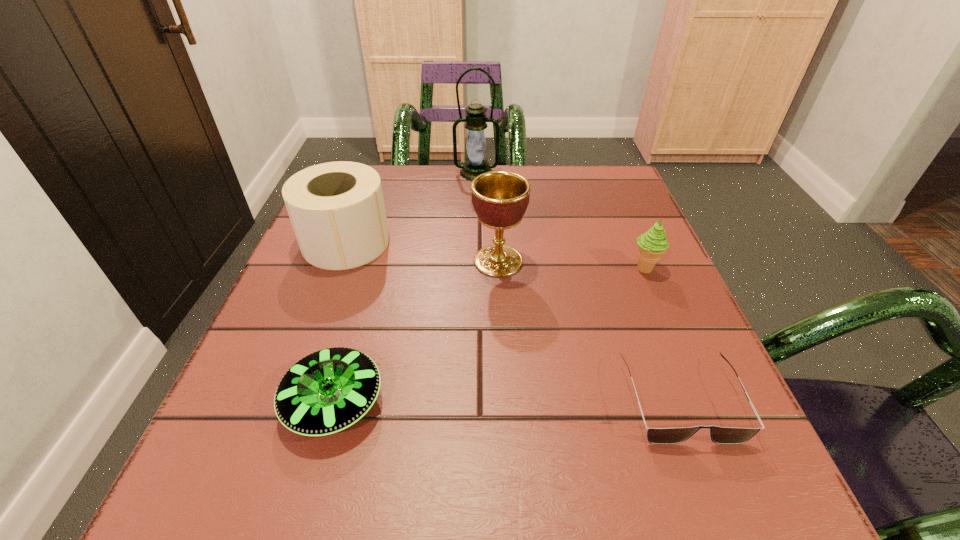
At what (x,y) coordinates should I click in order to perform the action: click on vacant space located 0.230m on the front of the icecream. Please return your answer as a coordinate pair (x, y). The width and height of the screenshot is (960, 540). Looking at the image, I should click on (689, 376).

The width and height of the screenshot is (960, 540). Identify the location of vacant space located 0.120m on the right of the saucer. (464, 403).

Find the location of a particular element. This screenshot has width=960, height=540. free region located on the front-facing side of the sunglasses is located at coordinates (717, 497).

You are a GUI agent. You are given a task and a screenshot of the screen. Output one action in this format:
    pyautogui.click(x=<x>, y=<y>)
    Task: Click on the object positioned at the far edge
    
    Given the screenshot: What is the action you would take?
    pyautogui.click(x=475, y=164)

Image resolution: width=960 pixels, height=540 pixels. In order to click on toilet tissue positioned at the left edge in this screenshot , I will do `click(337, 211)`.

The image size is (960, 540). What are the coordinates of `saucer that is at the left edge` in the screenshot? It's located at (327, 391).

Identify the location of icecream situated at the right edge. This screenshot has height=540, width=960. (652, 244).

At what (x,y) coordinates should I click in order to perform the action: click on sunglasses present at the right edge. Please return your answer as a coordinate pair (x, y). The height and width of the screenshot is (540, 960). Looking at the image, I should click on (720, 435).

In the image, there is a desktop. Where is `vacant space at the far edge`? vacant space at the far edge is located at coordinates (535, 204).

Locate an element on the screen. The width and height of the screenshot is (960, 540). vacant space at the left edge of the desktop is located at coordinates [328, 285].